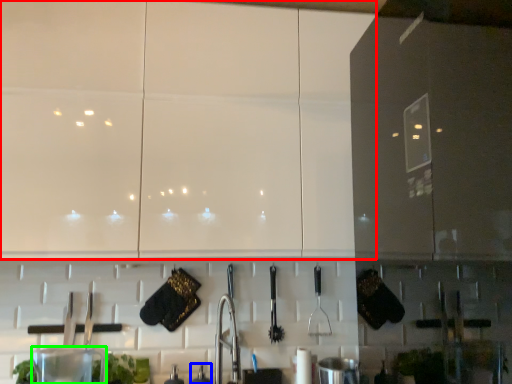
Question: Considering the real-world distances, which object is closest to cabinetry (highlighted by a red box)? appliance (highlighted by a blue box) or appliance (highlighted by a green box).

Choices:
 (A) appliance
 (B) appliance

Answer: (B)